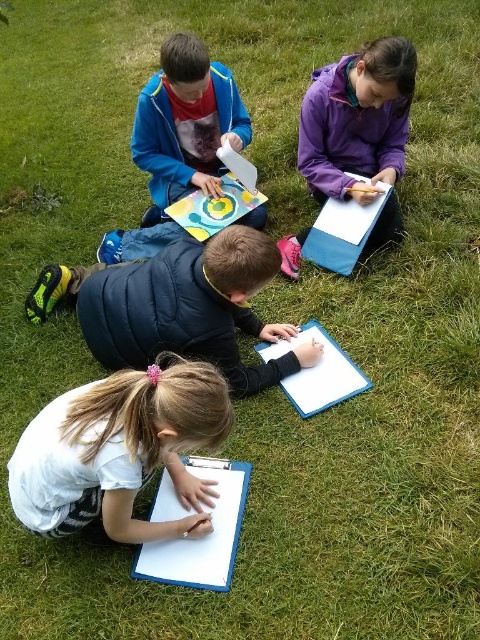
Which is behind, point (28, 312) or point (244, 122)?

Point (244, 122)

Who is lower down, black matte jacket at center or matte blue jacket at upper center?

black matte jacket at center

Which is in front, point (182, 314) or point (152, 241)?

Point (182, 314)

Find the location of a particular element. This screenshot has height=640, width=480. black matte jacket at center is located at coordinates (187, 307).

Is point (69, 529) in front of point (295, 333)?

Yes, point (69, 529) is in front of point (295, 333).

Does white paper at lower left have a greater height compared to black matte jacket at center?

In fact, white paper at lower left may be shorter than black matte jacket at center.

This screenshot has height=640, width=480. Identify the location of white paper at lower left. (120, 451).

This screenshot has width=480, height=640. Identify the location of white paper at lower left. (120, 451).

Which is more to the right, purple fleece jacket at upper right or matte blue jacket at upper center?

purple fleece jacket at upper right is more to the right.

Looking at this image, between purple fleece jacket at upper right and matte blue jacket at upper center, which one is positioned higher?

purple fleece jacket at upper right

Where is `purple fleece jacket at upper right`? purple fleece jacket at upper right is located at coordinates (357, 120).

Image resolution: width=480 pixels, height=640 pixels. Identify the location of purple fleece jacket at upper right. (357, 120).